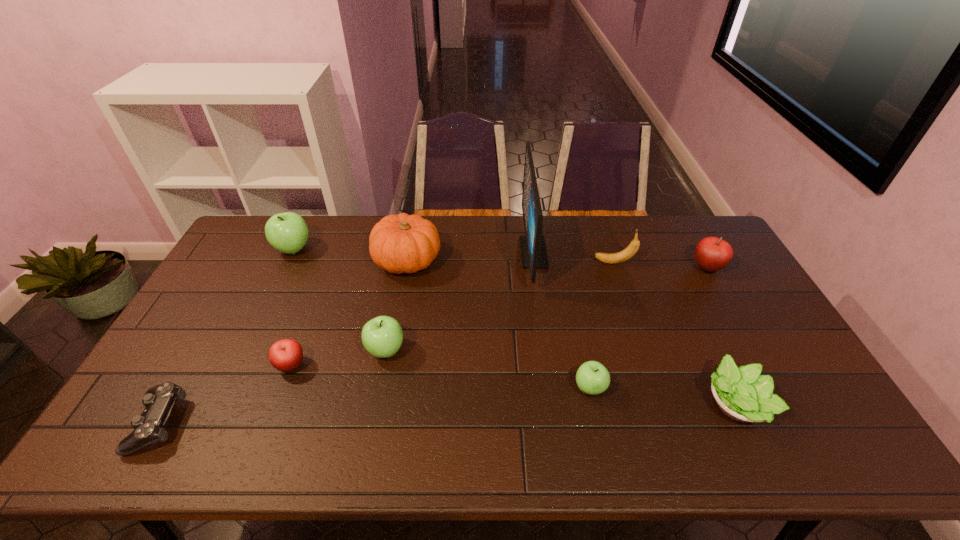
The width and height of the screenshot is (960, 540). I want to click on the second green apple from right to left, so click(382, 336).

Where is `the left red apple`? the left red apple is located at coordinates (285, 355).

Locate an element on the screen. the second apple from left to right is located at coordinates (285, 355).

At what (x,y) coordinates should I click in order to perform the action: click on the nearest green apple. Please return your answer as a coordinate pair (x, y). The width and height of the screenshot is (960, 540). Looking at the image, I should click on (592, 378).

Locate an element on the screen. This screenshot has height=540, width=960. the seventh object from left to right is located at coordinates (592, 378).

In order to click on green lettuce in this screenshot , I will do `click(742, 394)`.

Identify the location of control. The height and width of the screenshot is (540, 960). (148, 427).

At what (x,y) coordinates should I click in order to perform the action: click on free point located on the screen side of the tallest object. Please return your answer as a coordinate pair (x, y). This screenshot has height=540, width=960. Looking at the image, I should click on (501, 252).

This screenshot has width=960, height=540. In order to click on vacant space situated 0.280m on the screen side of the tallest object in this screenshot , I will do `click(442, 252)`.

Locate an element on the screen. vacant space located 0.120m on the screen side of the tallest object is located at coordinates (487, 252).